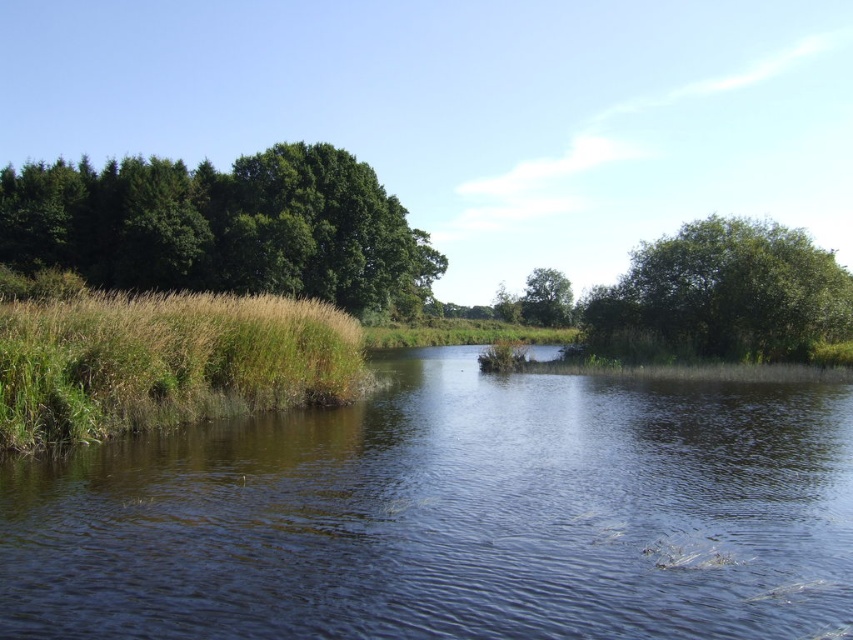
Question: Considering the relative positions of green grassy reed at left and green leafy tree at center in the image provided, where is green grassy reed at left located with respect to green leafy tree at center?

Choices:
 (A) left
 (B) right

Answer: (A)

Question: Can you confirm if dark water at center is thinner than green leafy trees at left?

Choices:
 (A) no
 (B) yes

Answer: (B)

Question: Which object appears farthest from the camera in this image?

Choices:
 (A) green leafy tree at center
 (B) green leafy tree at right
 (C) green leafy trees at left
 (D) dark water at center

Answer: (A)

Question: Which point is closer to the camera taking this photo?

Choices:
 (A) (195, 320)
 (B) (120, 259)
 (C) (410, 358)
 (D) (845, 289)

Answer: (A)

Question: Which of the following is the closest to the observer?

Choices:
 (A) green grassy reed at left
 (B) green leafy trees at left

Answer: (A)

Question: Does green grassy reed at left appear on the left side of green leafy tree at right?

Choices:
 (A) no
 (B) yes

Answer: (B)